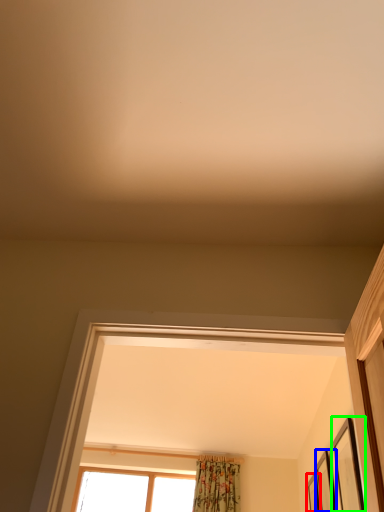
Question: Estimate the real-world distances between objects in this image. Which object is farther from picture frame (highlighted by a red box), picture frame (highlighted by a blue box) or picture frame (highlighted by a green box)?

Choices:
 (A) picture frame
 (B) picture frame

Answer: (B)